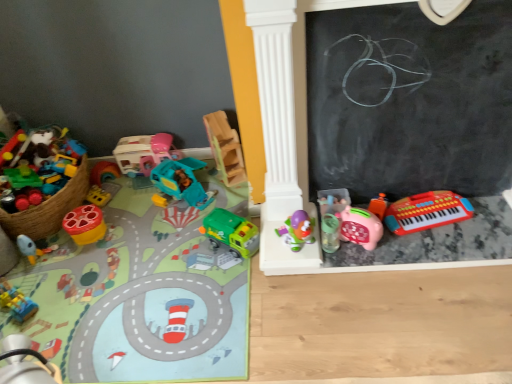
Find the location of a particular element. This screenshot has height=384, width=512. free space in front of rubberized plastic keyboard at lower right, the twelfth toy from the left is located at coordinates [x=454, y=246].